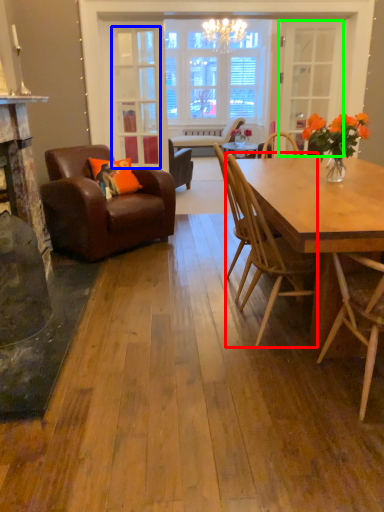
Question: Considering the real-world distances, which object is farthest from chair (highlighted by a red box)? glass door (highlighted by a blue box) or glass door (highlighted by a green box)?

Choices:
 (A) glass door
 (B) glass door

Answer: (B)